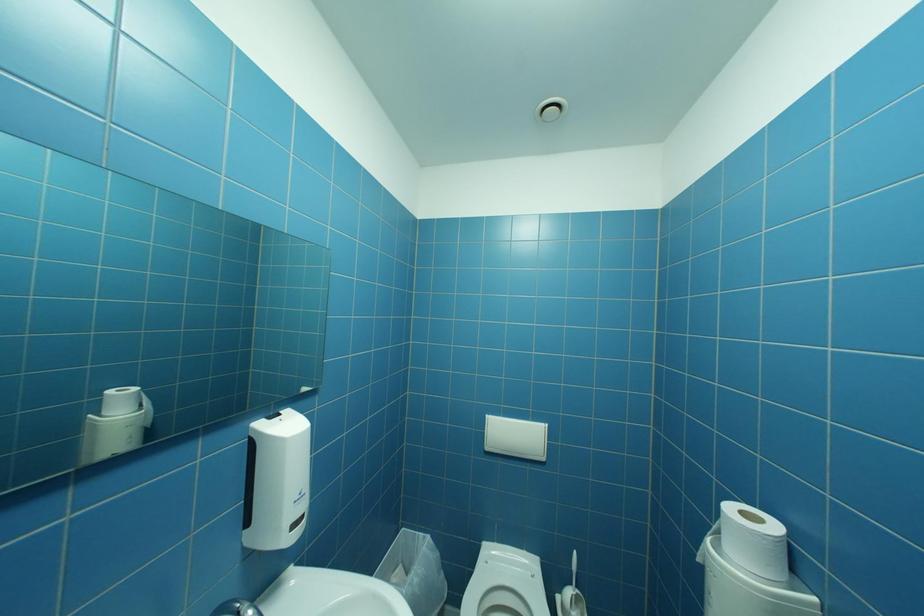
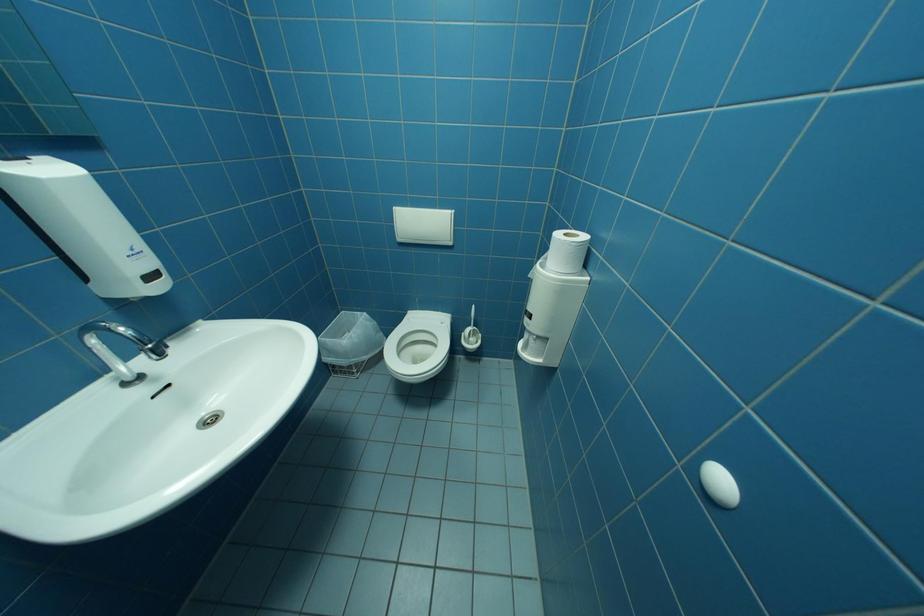
Question: Based on the continuous images, in which direction is the camera rotating? Reply with the corresponding letter.

Choices:
 (A) Left
 (B) Right
 (C) Up
 (D) Down

Answer: (D)